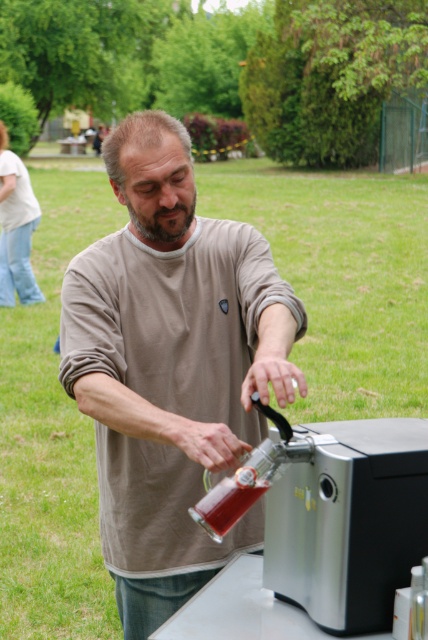
Between matte brown shirt at center and translucent glass bottle at center, which one is positioned lower?

translucent glass bottle at center is below.

Can you confirm if matte brown shirt at center is bigger than translucent glass bottle at center?

Yes, matte brown shirt at center is bigger than translucent glass bottle at center.

Which is in front, point (68, 332) or point (208, 500)?

Point (208, 500) is more forward.

What are the coordinates of `matte brown shirt at center` in the screenshot? It's located at click(x=171, y=365).